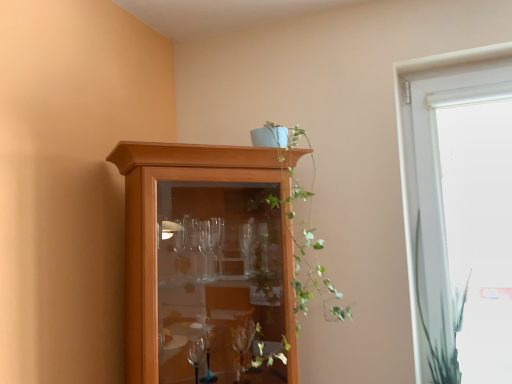
Question: Is wooden cabinet at upper center behind green leafy plant at upper center?

Choices:
 (A) yes
 (B) no

Answer: (B)

Question: Does wooden cabinet at upper center have a larger size compared to green leafy plant at upper center?

Choices:
 (A) yes
 (B) no

Answer: (A)

Question: From the image's perspective, would you say wooden cabinet at upper center is positioned over green leafy plant at upper center?

Choices:
 (A) yes
 (B) no

Answer: (B)

Question: Is wooden cabinet at upper center at the left side of green leafy plant at upper center?

Choices:
 (A) yes
 (B) no

Answer: (A)

Question: Is wooden cabinet at upper center facing towards green leafy plant at upper center?

Choices:
 (A) no
 (B) yes

Answer: (B)

Question: Can you confirm if wooden cabinet at upper center is taller than green leafy plant at upper center?

Choices:
 (A) yes
 (B) no

Answer: (A)

Question: Can you confirm if green leafy plant at right is smaller than white glass window at right?

Choices:
 (A) no
 (B) yes

Answer: (B)

Question: Does green leafy plant at right have a greater height compared to white glass window at right?

Choices:
 (A) no
 (B) yes

Answer: (A)

Question: Is green leafy plant at right wider than white glass window at right?

Choices:
 (A) no
 (B) yes

Answer: (B)

Question: Is green leafy plant at right far away from white glass window at right?

Choices:
 (A) no
 (B) yes

Answer: (A)

Question: Is the surface of green leafy plant at right in direct contact with white glass window at right?

Choices:
 (A) no
 (B) yes

Answer: (A)

Question: Is white glass window at right a part of green leafy plant at right?

Choices:
 (A) yes
 (B) no

Answer: (B)

Question: From a real-world perspective, is green leafy plant at upper center physically below white glass window at right?

Choices:
 (A) no
 (B) yes

Answer: (A)